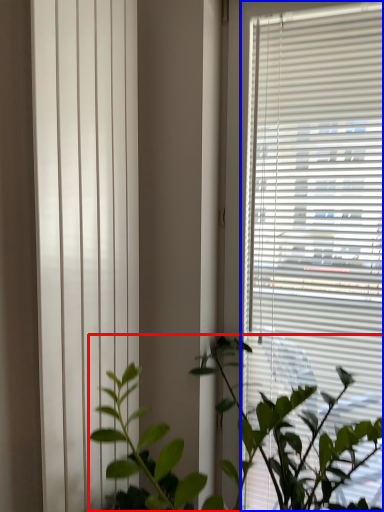
Question: Which object is further to the camera taking this photo, houseplant (highlighted by a red box) or window blind (highlighted by a blue box)?

Choices:
 (A) houseplant
 (B) window blind

Answer: (B)